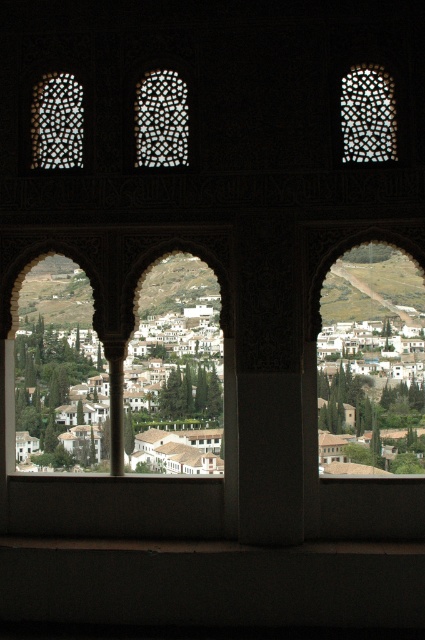
Question: Which object is the closest to the translucent mosaic tile at upper left?

Choices:
 (A) white textured buildings at center
 (B) translucent mosaic tile at center

Answer: (B)

Question: Can you confirm if white mosaic tile at upper right is thinner than translucent mosaic tile at upper left?

Choices:
 (A) yes
 (B) no

Answer: (B)

Question: Which of the following is the farthest from the observer?

Choices:
 (A) (419, 445)
 (B) (155, 81)

Answer: (A)

Question: Which point is closer to the camera taking this photo?

Choices:
 (A) (68, 442)
 (B) (180, 141)
 (C) (48, 145)
 (D) (382, 109)

Answer: (D)

Question: Does translucent mosaic tile at center have a greater width compared to translucent mosaic tile at upper left?

Choices:
 (A) no
 (B) yes

Answer: (B)

Question: Is white textured buildings at center bigger than white mosaic tile at upper right?

Choices:
 (A) no
 (B) yes

Answer: (B)